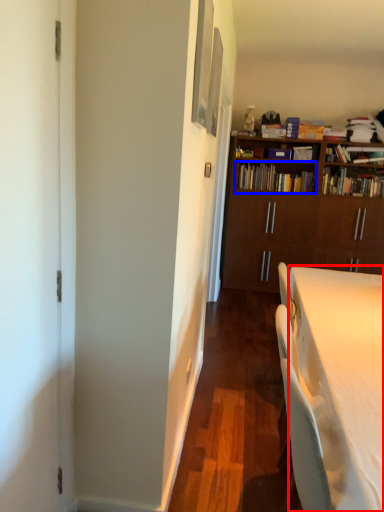
Question: Which object appears closest to the camera in this image, desk (highlighted by a red box) or book (highlighted by a blue box)?

Choices:
 (A) desk
 (B) book

Answer: (A)